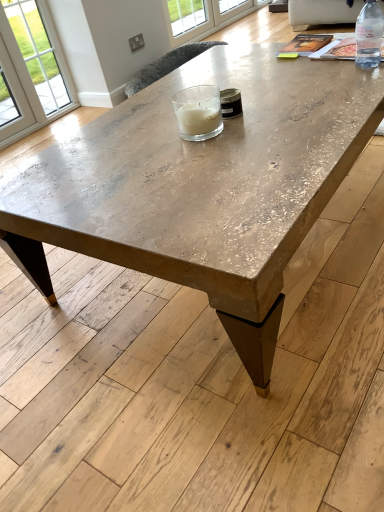
In order to face distressed wood coffee table at center, should I rotate leftwards or rightwards?

A 5.185 degree turn to the right will do.

This screenshot has width=384, height=512. What do you see at coordinates (204, 18) in the screenshot? I see `clear glass window at upper center` at bounding box center [204, 18].

Identify the location of beige fabric couch at upper right. (321, 13).

From the image's perspective, which is below, clear plastic bottle at upper right or clear glass candle at center?

From the image's view, clear glass candle at center is below.

Between clear plastic bottle at upper right and clear glass candle at center, which one has more height?

Standing taller between the two is clear plastic bottle at upper right.

From a real-world perspective, is clear plastic bottle at upper right physically above clear glass candle at center?

Correct, in the physical world, clear plastic bottle at upper right is higher than clear glass candle at center.

Would you say clear plastic bottle at upper right is inside or outside clear glass candle at center?

clear plastic bottle at upper right is located beyond the bounds of clear glass candle at center.

Considering the relative positions of distressed wood coffee table at center and clear glass candle at center in the image provided, is distressed wood coffee table at center in front of clear glass candle at center?

Yes, distressed wood coffee table at center is closer to the camera.

Find the location of a particular element. candle holder behind the distressed wood coffee table at center is located at coordinates (198, 112).

From a real-world perspective, which is physically below, distressed wood coffee table at center or clear glass candle at center?

distressed wood coffee table at center.

Is distressed wood coffee table at center not within clear glass candle at center?

Yes, distressed wood coffee table at center is not within clear glass candle at center.

Is clear glass candle at center surrounding clear glass window at upper center?

No, clear glass window at upper center is located outside of clear glass candle at center.

Is clear glass candle at center facing towards clear glass window at upper center?

No, clear glass candle at center is not facing towards clear glass window at upper center.

Locate an element on the screen. This screenshot has width=384, height=512. candle holder above the clear glass window at upper center (from a real-world perspective) is located at coordinates (198, 112).

Which is closer to the camera, (215,124) or (234,21)?

The point (215,124) is in front.

Is there a large distance between beige fabric couch at upper right and distressed wood coffee table at center?

beige fabric couch at upper right is positioned a significant distance from distressed wood coffee table at center.

Does beige fabric couch at upper right have a smaller size compared to distressed wood coffee table at center?

Yes.

Is beige fabric couch at upper right taller than distressed wood coffee table at center?

No, beige fabric couch at upper right is not taller than distressed wood coffee table at center.

Which is behind, point (193, 0) or point (71, 236)?

Point (193, 0)

Between clear glass window at upper center and distressed wood coffee table at center, which one has larger size?

distressed wood coffee table at center is bigger.

Is clear glass window at upper center far away from distressed wood coffee table at center?

That's right, there is a large distance between clear glass window at upper center and distressed wood coffee table at center.

Is clear glass window at upper center positioned beyond the bounds of distressed wood coffee table at center?

Yes, clear glass window at upper center is not within distressed wood coffee table at center.

Is point (346, 9) less distant than point (237, 15)?

Yes, it is in front of point (237, 15).

Which of these two, beige fabric couch at upper right or clear glass window at upper center, is wider?

beige fabric couch at upper right.

Is beige fabric couch at upper right taller than clear glass window at upper center?

No, beige fabric couch at upper right is not taller than clear glass window at upper center.

Identify the location of couch lying in front of the clear glass window at upper center. (321, 13).

Is the depth of clear plastic bottle at upper right less than that of clear glass window at upper center?

Yes, clear plastic bottle at upper right is closer to the camera.

From a real-world perspective, does clear plastic bottle at upper right stand above clear glass window at upper center?

Indeed, from a real-world perspective, clear plastic bottle at upper right stands above clear glass window at upper center.

What's the angular difference between clear plastic bottle at upper right and clear glass window at upper center's facing directions?

1.36 degrees.

What are the coordinates of `bottle positioned vertically above the clear glass window at upper center (from a real-world perspective)` in the screenshot? It's located at (369, 35).

The image size is (384, 512). What are the coordinates of `bottle behind the clear glass candle at center` in the screenshot? It's located at (369, 35).

In the image, there is a distressed wood coffee table at center. In order to click on candle holder above it (from the image's perspective) in this screenshot , I will do `click(198, 112)`.

Considering their positions, is beige fabric couch at upper right positioned closer to distressed wood coffee table at center than clear glass window at upper center?

clear glass window at upper center lies closer to distressed wood coffee table at center than the other object.

Based on their spatial positions, is beige fabric couch at upper right or clear plastic bottle at upper right closer to distressed wood coffee table at center?

clear plastic bottle at upper right is positioned closer to the anchor distressed wood coffee table at center.

Estimate the real-world distances between objects in this image. Which object is closer to clear glass candle at center, clear glass window at upper center or distressed wood coffee table at center?

Among the two, distressed wood coffee table at center is located nearer to clear glass candle at center.

Estimate the real-world distances between objects in this image. Which object is further from clear glass window at upper center, distressed wood coffee table at center or clear plastic bottle at upper right?

distressed wood coffee table at center is further to clear glass window at upper center.

Which object lies further to the anchor point clear plastic bottle at upper right, clear glass window at upper center or distressed wood coffee table at center?

The object further to clear plastic bottle at upper right is clear glass window at upper center.

When comparing their distances from clear plastic bottle at upper right, does distressed wood coffee table at center or clear glass window at upper center seem closer?

distressed wood coffee table at center is closer to clear plastic bottle at upper right.

When comparing their distances from distressed wood coffee table at center, does clear glass window at upper center or clear glass candle at center seem closer?

clear glass candle at center is closer to distressed wood coffee table at center.

When comparing their distances from beige fabric couch at upper right, does clear plastic bottle at upper right or clear glass window at upper center seem further?

clear plastic bottle at upper right.

What are the coordinates of `candle holder located between distressed wood coffee table at center and beige fabric couch at upper right in the depth direction` in the screenshot? It's located at (198, 112).

At what (x,y) coordinates should I click in order to perform the action: click on candle holder between distressed wood coffee table at center and clear glass window at upper center along the z-axis. Please return your answer as a coordinate pair (x, y). The width and height of the screenshot is (384, 512). Looking at the image, I should click on (198, 112).

Image resolution: width=384 pixels, height=512 pixels. I want to click on bottle between distressed wood coffee table at center and beige fabric couch at upper right from front to back, so click(x=369, y=35).

At what (x,y) coordinates should I click in order to perform the action: click on couch between distressed wood coffee table at center and clear glass window at upper center in the front-back direction. Please return your answer as a coordinate pair (x, y). Image resolution: width=384 pixels, height=512 pixels. Looking at the image, I should click on (321, 13).